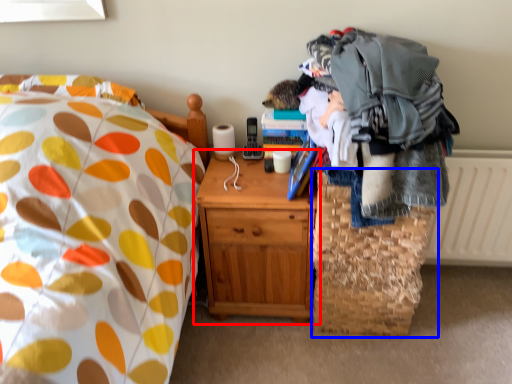
Question: Which point is closer to the camera, nightstand (highlighted by a red box) or basket (highlighted by a blue box)?

Choices:
 (A) nightstand
 (B) basket

Answer: (A)